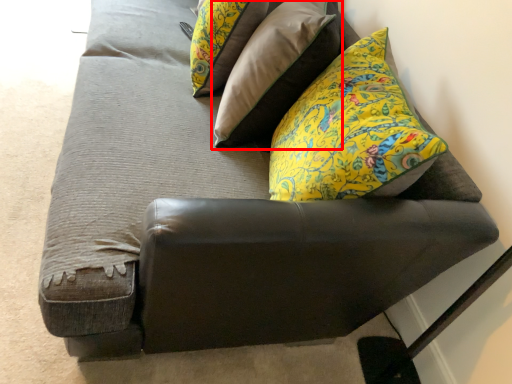
Question: From the image's perspective, considering the relative positions of pillow (annotated by the red box) and pillow in the image provided, where is pillow (annotated by the red box) located with respect to the staircase?

Choices:
 (A) below
 (B) above

Answer: (A)